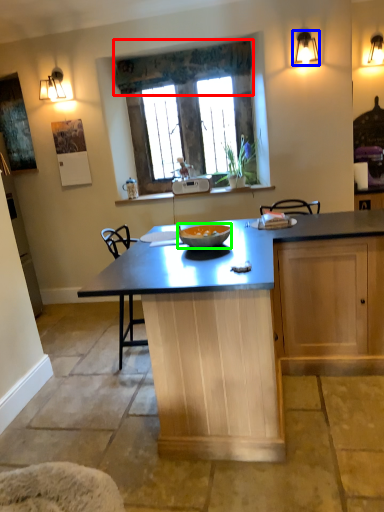
Question: Considering the real-world distances, which object is closest to curtain (highlighted by a red box)? light fixture (highlighted by a blue box) or glass bowl (highlighted by a green box).

Choices:
 (A) light fixture
 (B) glass bowl

Answer: (A)